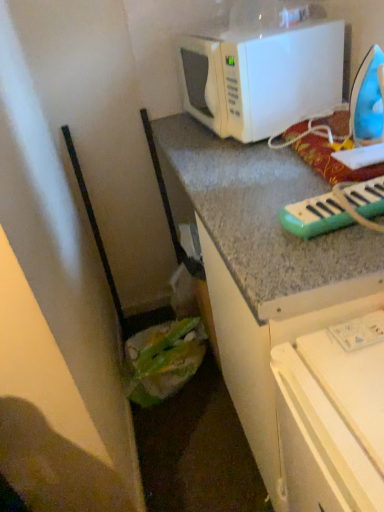
Question: Should I look upward or downward to see white matte microwave at upper center?

Choices:
 (A) down
 (B) up

Answer: (B)

Question: Is the depth of white matte microwave at upper center greater than that of blue plastic iron at upper right?

Choices:
 (A) yes
 (B) no

Answer: (A)

Question: From the image's perspective, is white matte microwave at upper center over blue plastic iron at upper right?

Choices:
 (A) no
 (B) yes

Answer: (B)

Question: Considering the relative sizes of white matte microwave at upper center and blue plastic iron at upper right in the image provided, is white matte microwave at upper center smaller than blue plastic iron at upper right?

Choices:
 (A) yes
 (B) no

Answer: (B)

Question: Is white matte microwave at upper center not close to blue plastic iron at upper right?

Choices:
 (A) yes
 (B) no

Answer: (B)

Question: Does white matte microwave at upper center have a greater width compared to blue plastic iron at upper right?

Choices:
 (A) no
 (B) yes

Answer: (B)

Question: Is white matte microwave at upper center shorter than blue plastic iron at upper right?

Choices:
 (A) no
 (B) yes

Answer: (A)

Question: Is blue plastic iron at upper right surrounded by green plastic musical keyboard at upper right?

Choices:
 (A) yes
 (B) no

Answer: (B)

Question: From a real-world perspective, is green plastic musical keyboard at upper right on top of blue plastic iron at upper right?

Choices:
 (A) yes
 (B) no

Answer: (B)

Question: Is green plastic musical keyboard at upper right thinner than blue plastic iron at upper right?

Choices:
 (A) yes
 (B) no

Answer: (B)

Question: Is green plastic musical keyboard at upper right turned away from blue plastic iron at upper right?

Choices:
 (A) no
 (B) yes

Answer: (A)

Question: From the image's perspective, is green plastic musical keyboard at upper right on blue plastic iron at upper right?

Choices:
 (A) yes
 (B) no

Answer: (B)

Question: Is green plastic musical keyboard at upper right positioned before blue plastic iron at upper right?

Choices:
 (A) no
 (B) yes

Answer: (B)

Question: From a real-world perspective, is green plastic musical keyboard at upper right on white matte microwave at upper center?

Choices:
 (A) yes
 (B) no

Answer: (B)